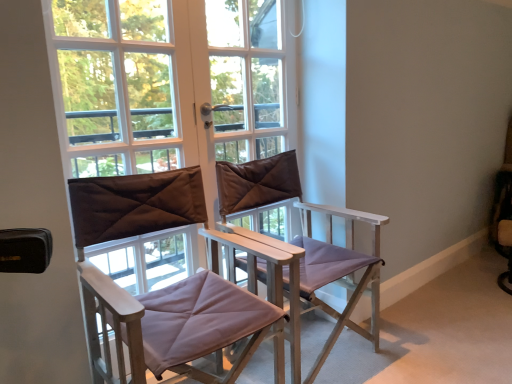
You are a GUI agent. You are given a task and a screenshot of the screen. Output one action in this format:
    pyautogui.click(x=<x>, y=<y>)
    Task: Click on the free region under purple fabric chair at center, which is the 2th chair in left-to-right order (from a real-world perspective)
    
    Given the screenshot: What is the action you would take?
    pyautogui.click(x=315, y=362)